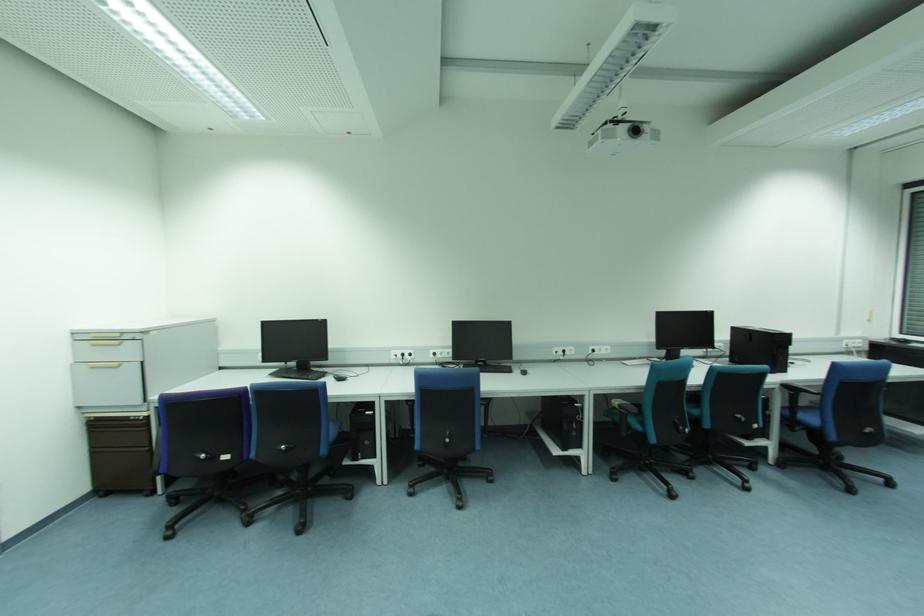
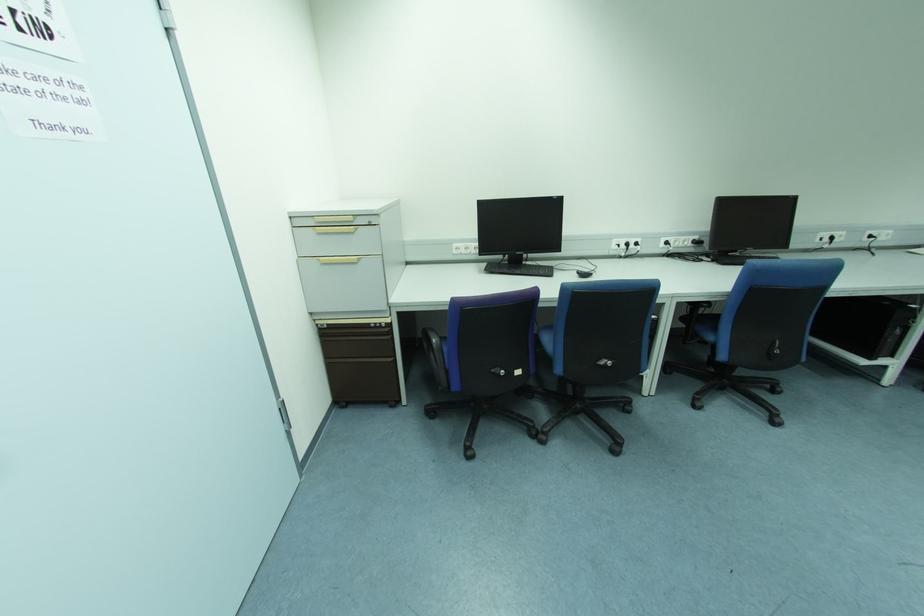
Find the pixel in the second image that matches (117,334) in the first image.

(350, 219)